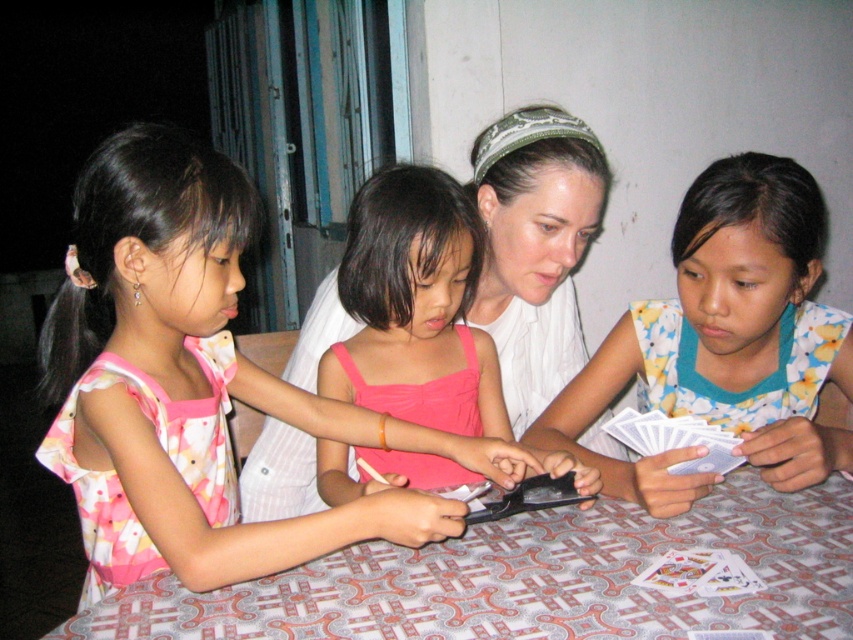
You are a guest at this card game table. You need to place a small vase on the table. Which object, the patterned fabric table at center or the floral fabric shirt at center, can you place the vase on?

The patterned fabric table at center is not as tall as the floral fabric shirt at center, so the vase can be placed on the patterned fabric table at center since it is a table surface.

You are a photographer standing behind the adult woman at the table. You want to take a photo of the pink satin dress at center without the patterned fabric table at center blocking it. Is this possible?

The patterned fabric table at center is in front of the pink satin dress at center, so taking a photo from behind the adult woman would have the table blocking the view of the dress. To capture the dress without obstruction, you would need to move to a position where the table is no longer between you and the dress.

You are standing at the edge of the table and see the point labeled as point [535,248]. Which object is directly under this point?

The point labeled as point [535,248] is on white fabric at center, so the white fabric at center is directly under this point.